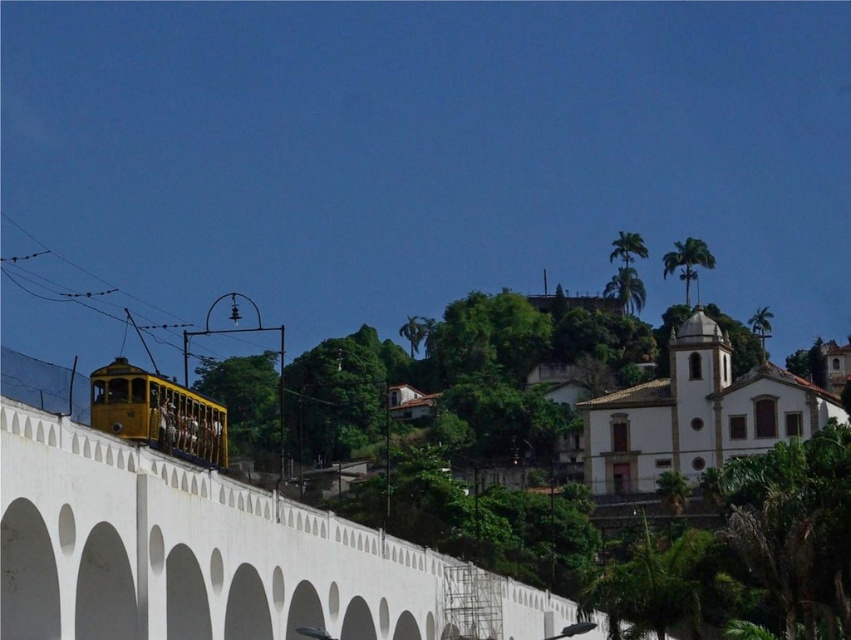
Is white concrete bridge at lower left closer to camera compared to yellow polished metal tram at lower left?

Yes, white concrete bridge at lower left is in front of yellow polished metal tram at lower left.

Does white concrete bridge at lower left appear over yellow polished metal tram at lower left?

No, white concrete bridge at lower left is not above yellow polished metal tram at lower left.

Is point (233, 534) more distant than point (107, 378)?

No, it is not.

This screenshot has height=640, width=851. In order to click on white concrete bridge at lower left in this screenshot , I will do `click(215, 556)`.